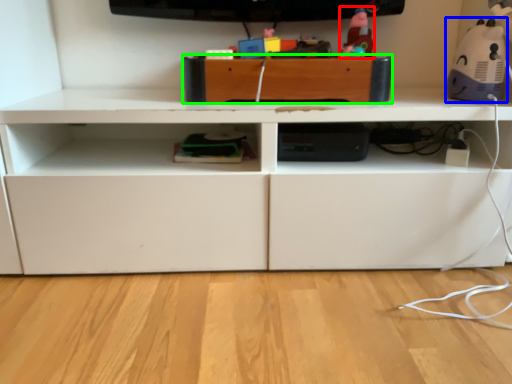
Question: Based on their relative distances, which object is nearer to toy (highlighted by a red box)? Choose from toy (highlighted by a blue box) and drawer (highlighted by a green box).

Choices:
 (A) toy
 (B) drawer

Answer: (B)